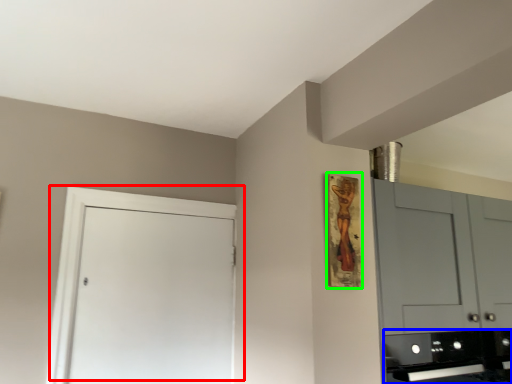
Question: Estimate the real-world distances between objects in this image. Which object is closer to door (highlighted by a red box), appliance (highlighted by a blue box) or picture frame (highlighted by a green box)?

Choices:
 (A) appliance
 (B) picture frame

Answer: (B)